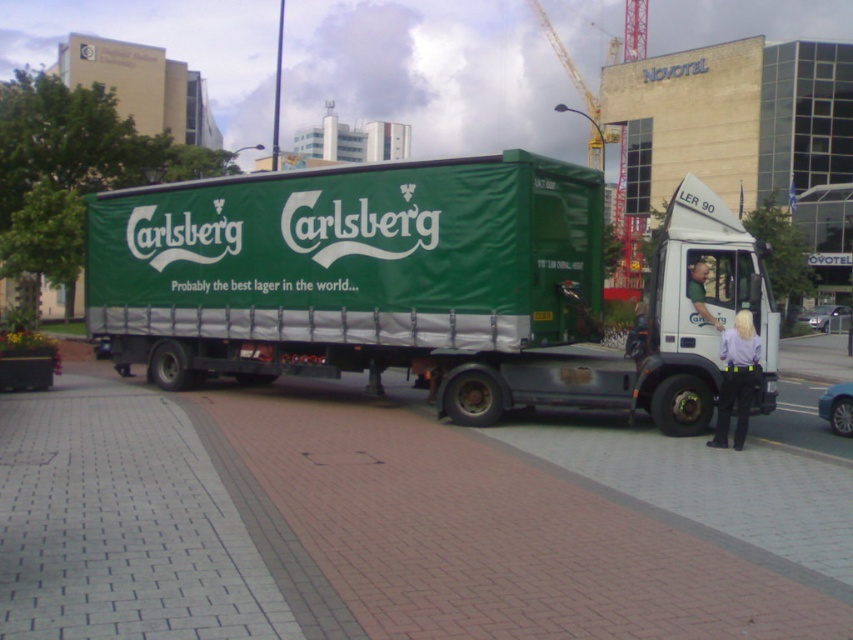
You are standing at point (x=349, y=470) and want to walk to the construction crane behind the Novotel building. The distance between you and the crane is 8.97 meters. Can you reach the crane within 2 minutes if you walk at 1.2 meters per second?

The distance between you and the crane is 8.97 meters. Walking at 1.2 meters per second, it would take approximately 7.48 seconds to reach the crane, which is well within 2 minutes. Yes, you can reach the crane in time.

You are a delivery person standing on the brick pavement at center and need to place a light brown leather jacket at center on the truck. Can you step aside to make space without moving the jacket?

The brick pavement at center is positioned under the light brown leather jacket at center, so you can step aside to make space without moving the jacket since the jacket is already on the pavement.

You are a delivery driver who just arrived at the Novotel hotel. You need to park your green fabric truck at center so that the Carlsberg logo is visible to the reception. Where should you position the brick pavement at center relative to your truck?

The brick pavement at center should be positioned in front of the green fabric truck at center so that the logo on the truck is facing towards the reception area, ensuring visibility.